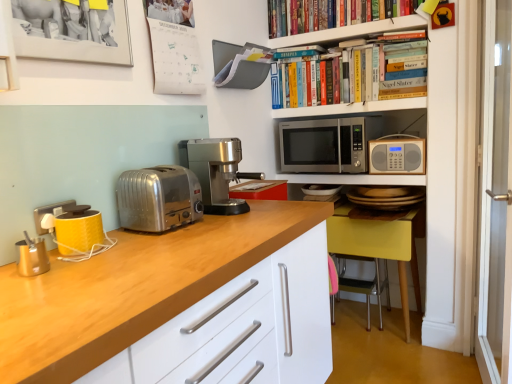
Question: Does yellow matte coffee machine at left, the second coffee machine in the back-to-front sequence, have a greater width compared to polished stainless steel coffee machine at center, which appears as the second coffee machine when viewed from the front?

Choices:
 (A) yes
 (B) no

Answer: (B)

Question: From the image's perspective, is yellow matte coffee machine at left, the second coffee machine in the back-to-front sequence, on polished stainless steel coffee machine at center, which ranks as the 1th coffee machine in right-to-left order?

Choices:
 (A) no
 (B) yes

Answer: (A)

Question: Can we say yellow matte coffee machine at left, the second coffee machine in the back-to-front sequence, lies outside polished stainless steel coffee machine at center, which appears as the second coffee machine when viewed from the front?

Choices:
 (A) yes
 (B) no

Answer: (A)

Question: From a real-world perspective, is yellow matte coffee machine at left, which ranks as the second coffee machine in right-to-left order, located higher than polished stainless steel coffee machine at center, which ranks as the 1th coffee machine in right-to-left order?

Choices:
 (A) no
 (B) yes

Answer: (A)

Question: Is yellow matte coffee machine at left, which is the 1th coffee machine in front-to-back order, looking in the opposite direction of polished stainless steel coffee machine at center, which appears as the second coffee machine when viewed from the front?

Choices:
 (A) no
 (B) yes

Answer: (A)

Question: Is stainless steel microwave at upper center bigger or smaller than wooden radio at right?

Choices:
 (A) big
 (B) small

Answer: (A)

Question: From a real-world perspective, relative to wooden radio at right, is stainless steel microwave at upper center vertically above or below?

Choices:
 (A) below
 (B) above

Answer: (B)

Question: In the image, is stainless steel microwave at upper center positioned in front of or behind wooden radio at right?

Choices:
 (A) front
 (B) behind

Answer: (B)

Question: Is point (328, 135) positioned closer to the camera than point (397, 134)?

Choices:
 (A) farther
 (B) closer

Answer: (A)

Question: From the image's perspective, is yellow wood chair at lower right, which is the 2th chair in back-to-front order, above or below hardcover books at upper center, marked as the second shelf in a top-to-bottom arrangement?

Choices:
 (A) below
 (B) above

Answer: (A)

Question: Looking at the image, does yellow wood chair at lower right, the 1th chair positioned from the front, seem bigger or smaller compared to hardcover books at upper center, the 1th shelf ordered from the bottom?

Choices:
 (A) small
 (B) big

Answer: (B)

Question: From a real-world perspective, is yellow wood chair at lower right, the 1th chair positioned from the front, physically located above or below hardcover books at upper center, the 1th shelf ordered from the bottom?

Choices:
 (A) below
 (B) above

Answer: (A)

Question: Is yellow wood chair at lower right, which is the 2th chair in back-to-front order, taller or shorter than hardcover books at upper center, the 1th shelf ordered from the bottom?

Choices:
 (A) short
 (B) tall

Answer: (B)

Question: Is polished stainless steel coffee machine at center, which ranks as the 1th coffee machine in right-to-left order, inside the boundaries of hardcover books at upper center, the 1th shelf ordered from the bottom, or outside?

Choices:
 (A) inside
 (B) outside

Answer: (B)

Question: Is polished stainless steel coffee machine at center, which ranks as the 1th coffee machine in right-to-left order, taller or shorter than hardcover books at upper center, the 1th shelf ordered from the bottom?

Choices:
 (A) short
 (B) tall

Answer: (B)